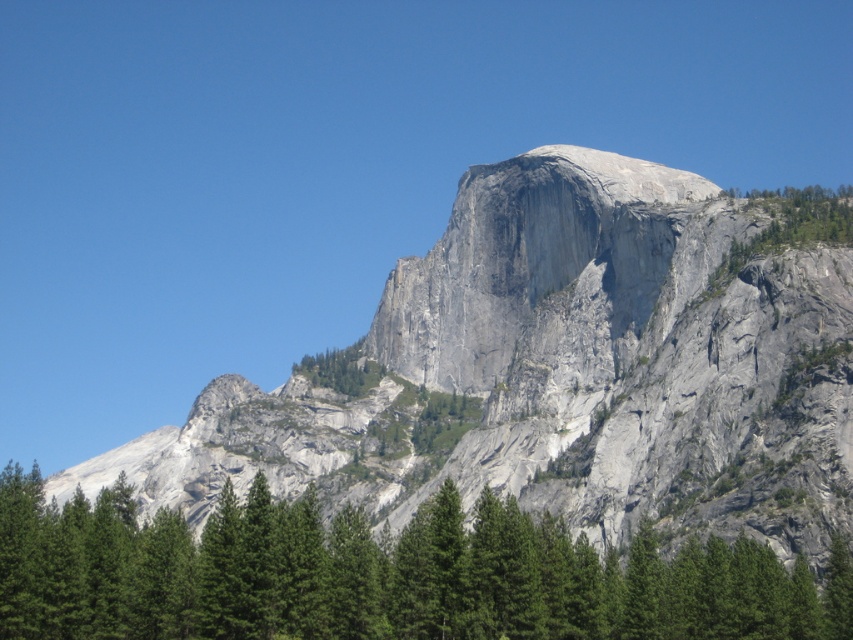
Question: Does gray/granite peak at center appear under green leafy tree at center?

Choices:
 (A) no
 (B) yes

Answer: (A)

Question: Which object is closer to the camera taking this photo?

Choices:
 (A) gray rock mountain at center
 (B) green textured tree at center
 (C) green leafy tree at center
 (D) gray/granite peak at center

Answer: (B)

Question: Which is farther from the green leafy tree at center?

Choices:
 (A) gray rock mountain at center
 (B) green textured tree at center
 (C) gray/granite peak at center

Answer: (B)

Question: From the image, what is the correct spatial relationship of green textured tree at center in relation to gray/granite peak at center?

Choices:
 (A) right
 (B) left

Answer: (B)

Question: Is gray rock mountain at center closer to the viewer compared to green leafy tree at center?

Choices:
 (A) yes
 (B) no

Answer: (A)

Question: Based on their relative distances, which object is farther from the green leafy tree at center?

Choices:
 (A) gray rock mountain at center
 (B) green textured tree at center
 (C) gray/granite peak at center

Answer: (B)